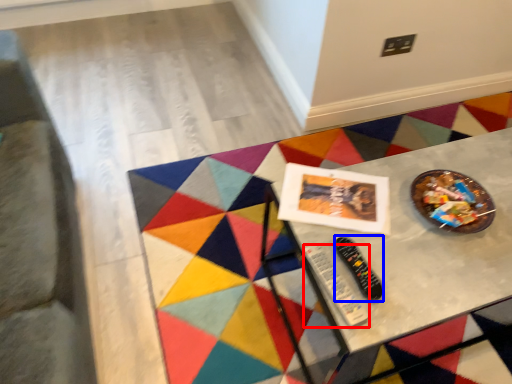
Question: Which of the following is the farthest to the observer, control (highlighted by a red box) or control (highlighted by a blue box)?

Choices:
 (A) control
 (B) control

Answer: (B)